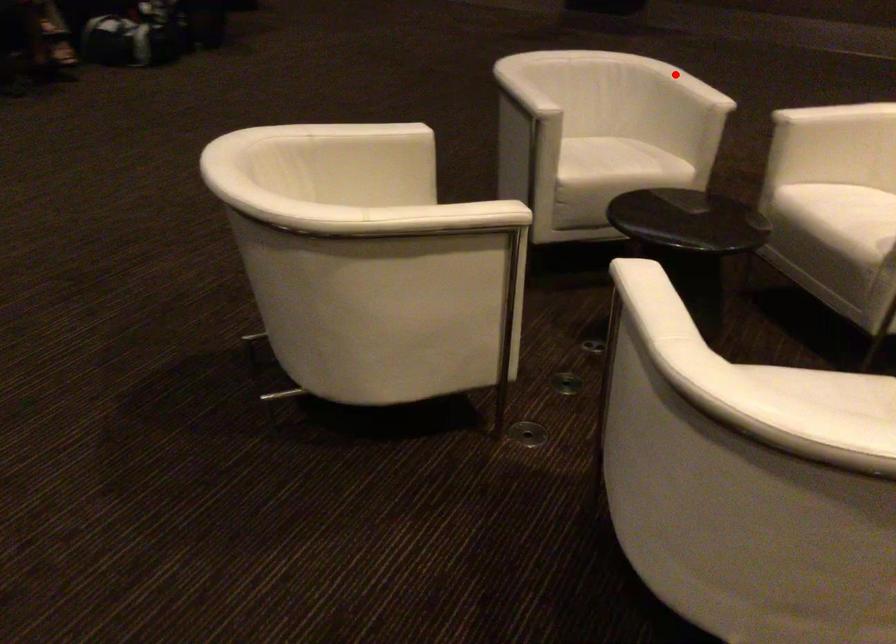
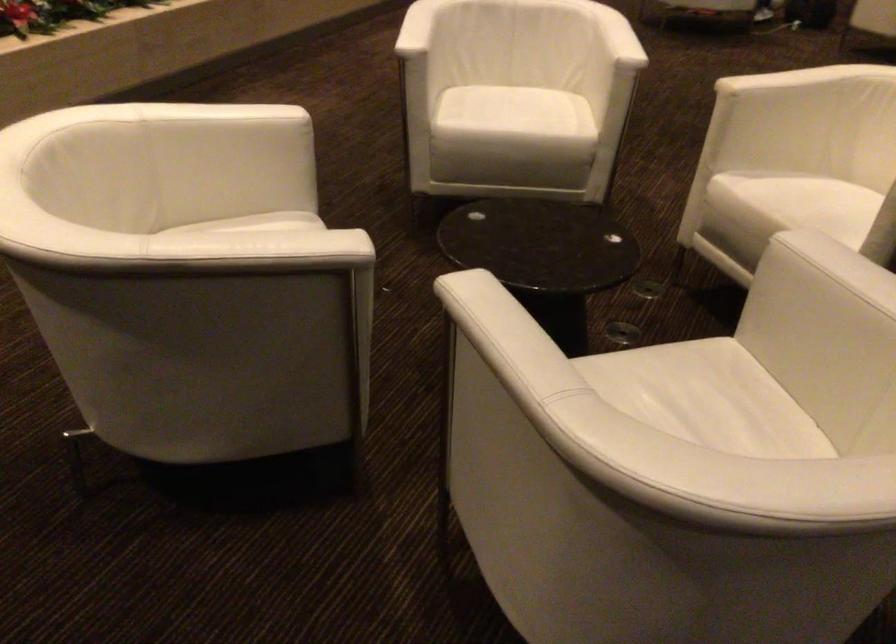
Locate, in the second image, the point that corresponds to the highlighted location in the first image.

(494, 322)